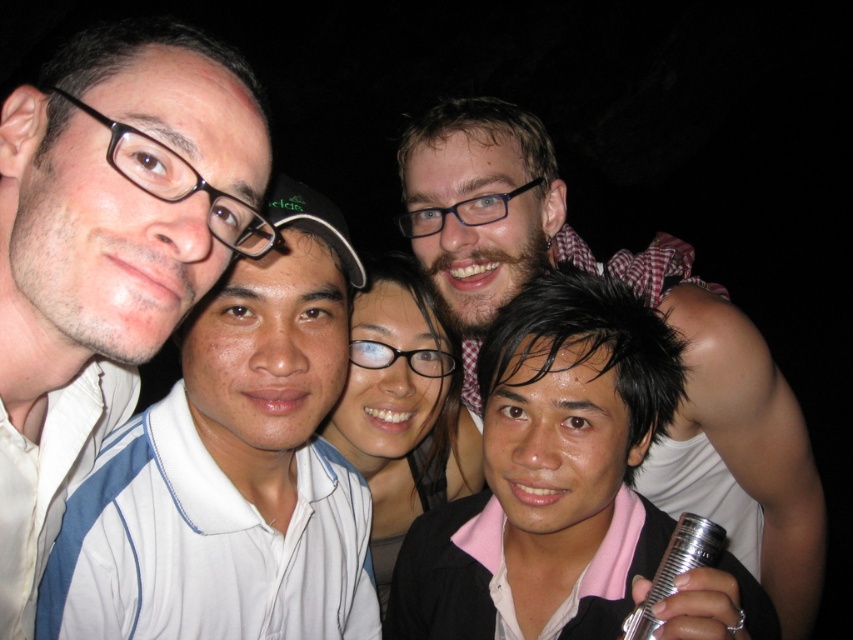
Based on the scene description, where is the matte white shirt at left located in the image?

The matte white shirt at left is located at point (107, 252) in the image.

You are trying to take a photo of the bearded man at center but the matte white shirt at left is blocking your view. Can you move to the right side to get a clear shot?

The matte white shirt at left is positioned over the bearded man at center, so moving to the right side might allow you to see around the obstruction caused by the matte white shirt at left and capture the bearded man at center clearly.

You are a photographer trying to adjust the focus of your camera. You need to ensure that both the matte white shirt at left and the bearded man at center are in focus. Given that the camera can only focus on one subject at a time, which subject should you prioritize focusing on to ensure the other is also in focus?

You should prioritize focusing on the bearded man at center because the matte white shirt at left is smaller than the bearded man at center, meaning the bearded man is closer to the camera. By focusing on the closer subject, the depth of field may extend to include the farther subject in acceptable focus.